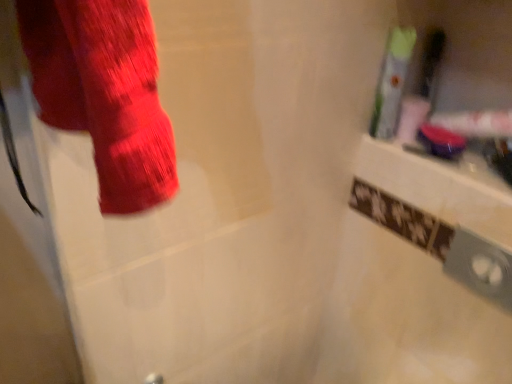
Question: Considering the relative sizes of translucent plastic toothbrush at upper right, which is counted as the 2th toiletry, starting from the left, and green plastic toothbrush at upper right, the 1th toiletry in the left-to-right sequence, in the image provided, is translucent plastic toothbrush at upper right, which is counted as the 2th toiletry, starting from the left, taller than green plastic toothbrush at upper right, the 1th toiletry in the left-to-right sequence,?

Choices:
 (A) no
 (B) yes

Answer: (A)

Question: Does translucent plastic toothbrush at upper right, which is counted as the 2th toiletry, starting from the left, come behind green plastic toothbrush at upper right, the 1th toiletry in the left-to-right sequence?

Choices:
 (A) no
 (B) yes

Answer: (B)

Question: Considering the relative sizes of translucent plastic toothbrush at upper right, the 1th toiletry when ordered from right to left, and green plastic toothbrush at upper right, acting as the 2th toiletry starting from the right, in the image provided, is translucent plastic toothbrush at upper right, the 1th toiletry when ordered from right to left, smaller than green plastic toothbrush at upper right, acting as the 2th toiletry starting from the right,?

Choices:
 (A) no
 (B) yes

Answer: (B)

Question: From the image's perspective, is translucent plastic toothbrush at upper right, the 1th toiletry when ordered from right to left, above green plastic toothbrush at upper right, the 1th toiletry in the left-to-right sequence?

Choices:
 (A) yes
 (B) no

Answer: (A)

Question: Does translucent plastic toothbrush at upper right, which is counted as the 2th toiletry, starting from the left, come in front of green plastic toothbrush at upper right, acting as the 2th toiletry starting from the right?

Choices:
 (A) no
 (B) yes

Answer: (A)

Question: Can you confirm if translucent plastic toothbrush at upper right, the 1th toiletry when ordered from right to left, is shorter than green plastic toothbrush at upper right, the 1th toiletry in the left-to-right sequence?

Choices:
 (A) yes
 (B) no

Answer: (A)

Question: Considering the relative sizes of green plastic toothbrush at upper right, acting as the 2th toiletry starting from the right, and translucent plastic toothbrush at upper right, the 1th toiletry when ordered from right to left, in the image provided, is green plastic toothbrush at upper right, acting as the 2th toiletry starting from the right, smaller than translucent plastic toothbrush at upper right, the 1th toiletry when ordered from right to left,?

Choices:
 (A) no
 (B) yes

Answer: (A)

Question: Can you see green plastic toothbrush at upper right, the 1th toiletry in the left-to-right sequence, touching translucent plastic toothbrush at upper right, the 1th toiletry when ordered from right to left?

Choices:
 (A) no
 (B) yes

Answer: (B)

Question: Can you confirm if green plastic toothbrush at upper right, the 1th toiletry in the left-to-right sequence, is bigger than translucent plastic toothbrush at upper right, the 1th toiletry when ordered from right to left?

Choices:
 (A) yes
 (B) no

Answer: (A)

Question: Is translucent plastic toothbrush at upper right, which is counted as the 2th toiletry, starting from the left, completely or partially inside green plastic toothbrush at upper right, the 1th toiletry in the left-to-right sequence?

Choices:
 (A) yes
 (B) no

Answer: (B)

Question: From a real-world perspective, is green plastic toothbrush at upper right, acting as the 2th toiletry starting from the right, under translucent plastic toothbrush at upper right, which is counted as the 2th toiletry, starting from the left?

Choices:
 (A) yes
 (B) no

Answer: (B)

Question: Considering the relative sizes of green plastic toothbrush at upper right, the 1th toiletry in the left-to-right sequence, and translucent plastic toothbrush at upper right, the 1th toiletry when ordered from right to left, in the image provided, is green plastic toothbrush at upper right, the 1th toiletry in the left-to-right sequence, thinner than translucent plastic toothbrush at upper right, the 1th toiletry when ordered from right to left,?

Choices:
 (A) no
 (B) yes

Answer: (A)

Question: In terms of width, does green plastic toothbrush at upper right, acting as the 2th toiletry starting from the right, look wider or thinner when compared to translucent plastic toothbrush at upper right, which is counted as the 2th toiletry, starting from the left?

Choices:
 (A) wide
 (B) thin

Answer: (A)